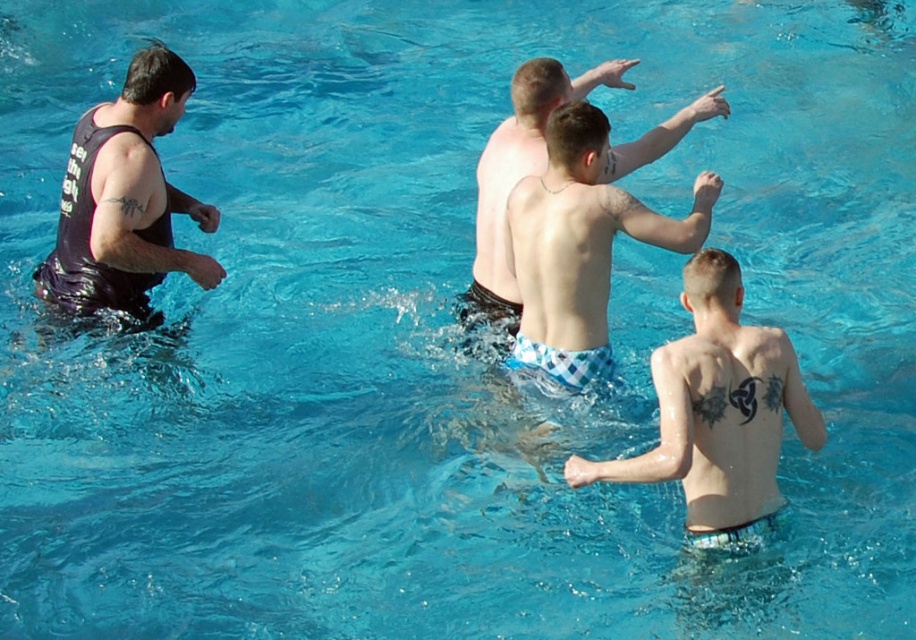
Does matte black tank top at left have a greater width compared to light blue checkered shorts at center?

Correct, the width of matte black tank top at left exceeds that of light blue checkered shorts at center.

Based on the photo, is matte black tank top at left above light blue checkered shorts at center?

Actually, matte black tank top at left is below light blue checkered shorts at center.

Locate an element on the screen. This screenshot has width=916, height=640. matte black tank top at left is located at coordinates (124, 200).

Which is above, checkered fabric shorts at center or matte black tank top at left?

Positioned higher is matte black tank top at left.

Who is more distant from viewer, (704, 404) or (124, 200)?

The point (124, 200) is more distant.

This screenshot has height=640, width=916. I want to click on checkered fabric shorts at center, so click(x=718, y=410).

Is point (718, 444) closer to viewer compared to point (661, 132)?

That is True.

Can you confirm if checkered fabric shorts at center is positioned to the right of light blue checkered shorts at center?

Yes, checkered fabric shorts at center is to the right of light blue checkered shorts at center.

Which is behind, point (641, 465) or point (624, 170)?

The point (624, 170) is more distant.

The height and width of the screenshot is (640, 916). What are the coordinates of `checkered fabric shorts at center` in the screenshot? It's located at (718, 410).